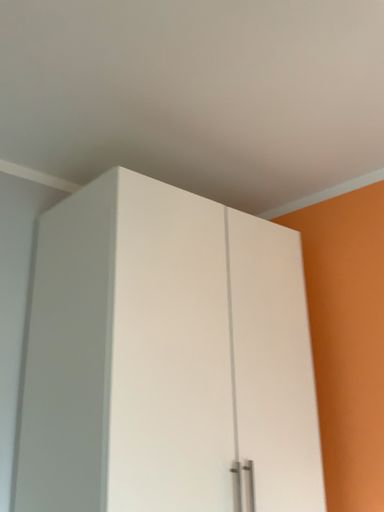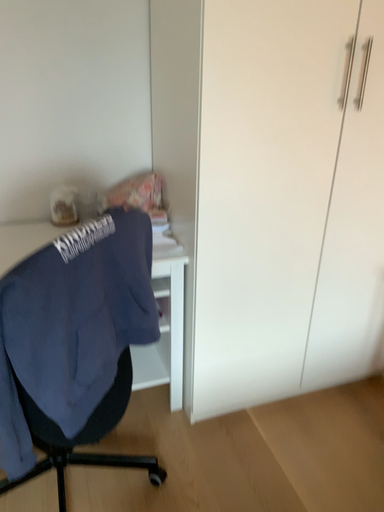
Question: How did the camera likely rotate when shooting the video?

Choices:
 (A) rotated upward
 (B) rotated downward

Answer: (B)